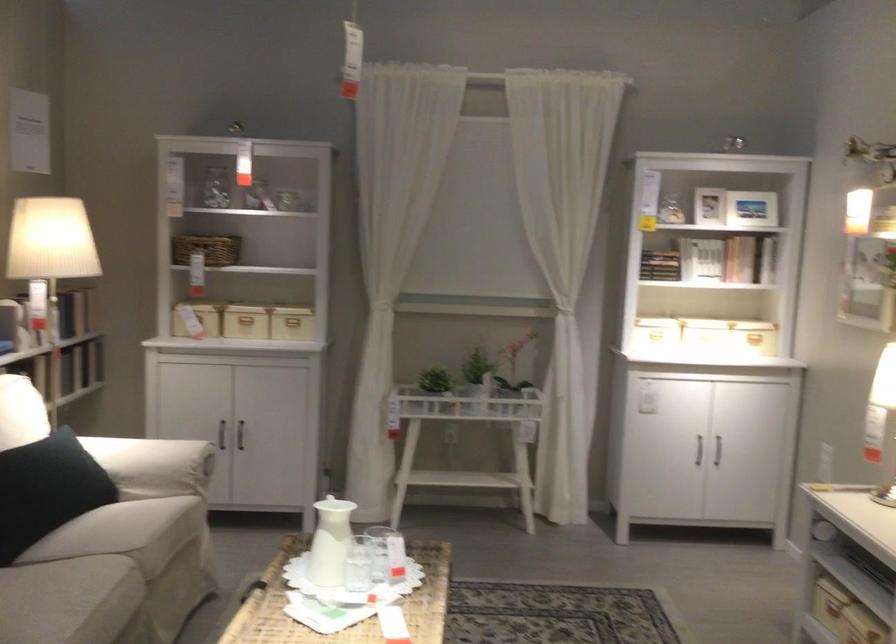
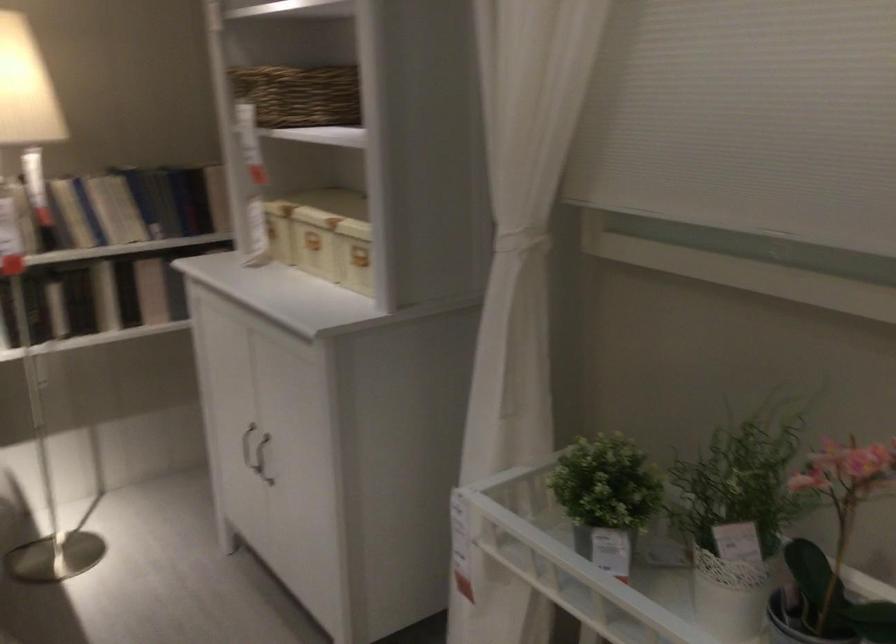
In the second image, find the point that corresponds to the point at 261,315 in the first image.

(314, 242)